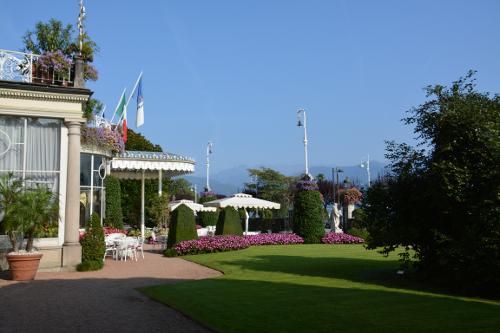
Find the location of a particular element. This screenshot has width=500, height=333. decorative windows is located at coordinates [x=23, y=171].